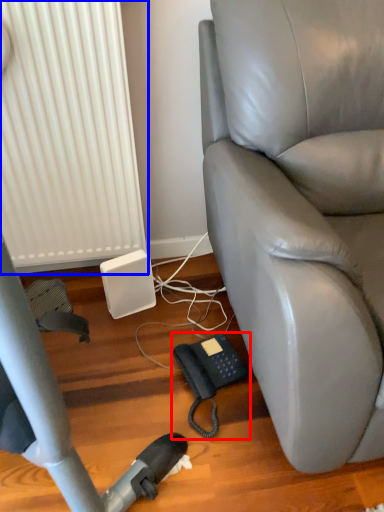
Question: Which object is closer to the camera taking this photo, corded phone (highlighted by a red box) or radiator (highlighted by a blue box)?

Choices:
 (A) corded phone
 (B) radiator

Answer: (B)